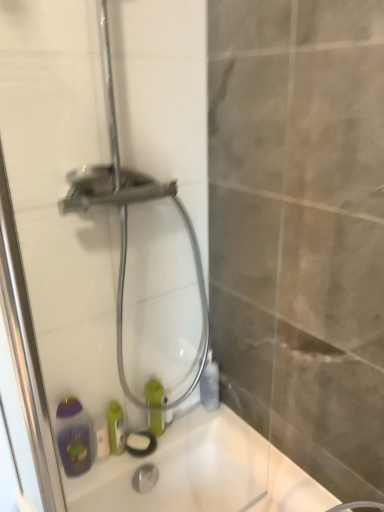
Where is `vacant area that lies to the right of green matte bottle at center, placed as the 1th bottle when sorted from left to right`? vacant area that lies to the right of green matte bottle at center, placed as the 1th bottle when sorted from left to right is located at coordinates (206, 423).